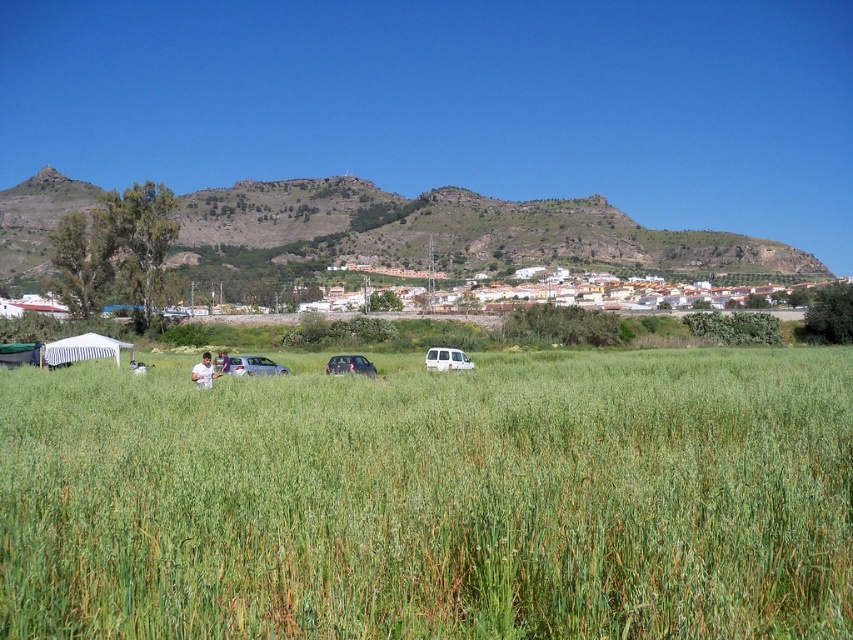
Describe the element at coordinates (253, 365) in the screenshot. This screenshot has width=853, height=640. I see `silver metallic car at center` at that location.

Who is taller, silver metallic car at center or white fabric at lower center?

With more height is white fabric at lower center.

You are a GUI agent. You are given a task and a screenshot of the screen. Output one action in this format:
    pyautogui.click(x=<x>, y=<y>)
    Task: Click on the silver metallic car at center
    
    Given the screenshot: What is the action you would take?
    pyautogui.click(x=253, y=365)

Between white matte van at center and white fabric at lower center, which one appears on the left side from the viewer's perspective?

Positioned to the left is white fabric at lower center.

Between white matte van at center and white fabric at lower center, which one is positioned higher?

white matte van at center

Who is more distant from viewer, (433, 365) or (201, 378)?

Point (433, 365)

This screenshot has width=853, height=640. What are the coordinates of `white matte van at center` in the screenshot? It's located at (445, 358).

Does silver metallic car at center have a greater width compared to white matte van at center?

Indeed, silver metallic car at center has a greater width compared to white matte van at center.

This screenshot has height=640, width=853. Describe the element at coordinates (253, 365) in the screenshot. I see `silver metallic car at center` at that location.

Where is `silver metallic car at center`? The height and width of the screenshot is (640, 853). silver metallic car at center is located at coordinates (253, 365).